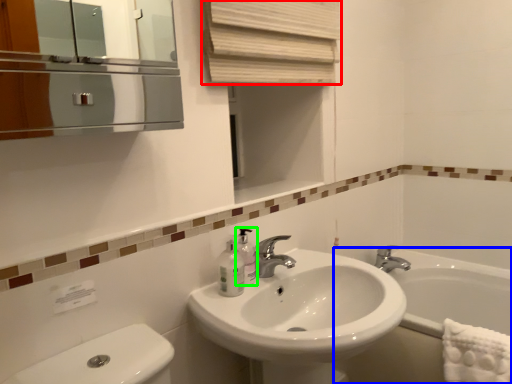
Question: Based on their relative distances, which object is nearer to curtain (highlighted by a red box)? Choose from bath (highlighted by a blue box) and soap dispenser (highlighted by a green box).

Choices:
 (A) bath
 (B) soap dispenser

Answer: (B)